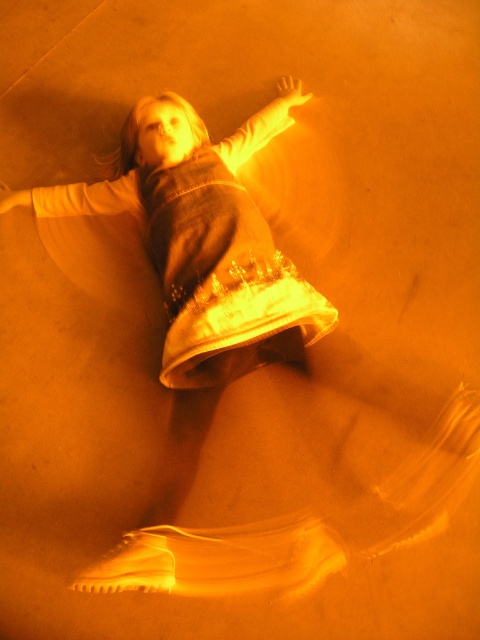
You are a photographer setting up a shot of the child in the scene. You want to place a small prop exactly halfway between point (57, 202) and point (282, 113). Will the prop be closer to the child or further away compared to the original points?

The prop placed halfway between point (57, 202) and point (282, 113) will be further away from the viewer than point (57, 202) but closer than point (282, 113). Since point (57, 202) is closer to the viewer, the midpoint will be positioned between them in terms of depth, so it won spatial reasoning to be further away than the closer point but nearer than the farther one.

You are a fashion designer observing the child in the scene. You notice the white satin dress at center and the matte yellow sleeve at upper left. Which item is located closer to the bottom of the image?

The white satin dress at center is positioned under the matte yellow sleeve at upper left, so the white satin dress at center is closer to the bottom of the image.

You are a photographer setting up a shoot. You need to place a small prop between the matte yellow sleeve at upper left and the matte white arm at upper center. Based on their positions, where should you place the prop to ensure it is centered between them?

The prop should be placed between the matte yellow sleeve at upper left and the matte white arm at upper center, centered between them since the matte yellow sleeve at upper left is on the left side of the matte white arm at upper center.